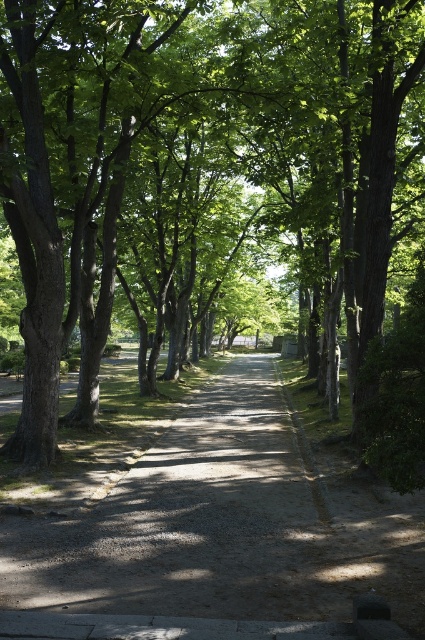
How much distance is there between green leafy tree at center and dirt/gravel path at center?

The distance of green leafy tree at center from dirt/gravel path at center is 7.81 meters.

Who is shorter, green leafy tree at center or dirt/gravel path at center?

With less height is dirt/gravel path at center.

At what (x,y) coordinates should I click in order to perform the action: click on green leafy tree at center. Please return your answer as a coordinate pair (x, y). This screenshot has height=640, width=425. Looking at the image, I should click on (217, 161).